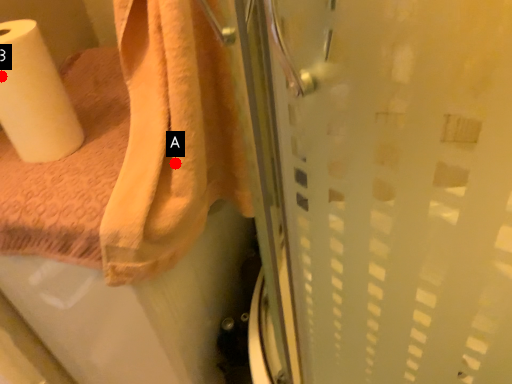
Question: Two points are circled on the image, labeled by A and B beside each circle. Which point is further to the camera?

Choices:
 (A) A is further
 (B) B is further

Answer: (B)